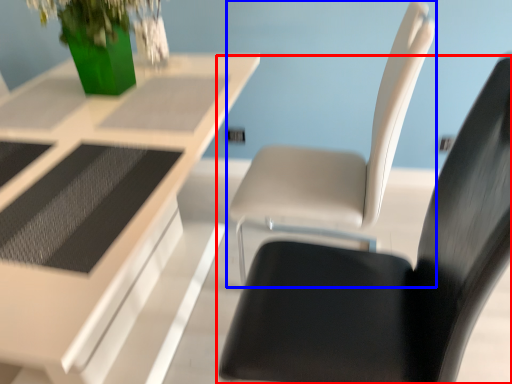
Question: Which object is closer to the camera taking this photo, chair (highlighted by a red box) or chair (highlighted by a blue box)?

Choices:
 (A) chair
 (B) chair

Answer: (A)